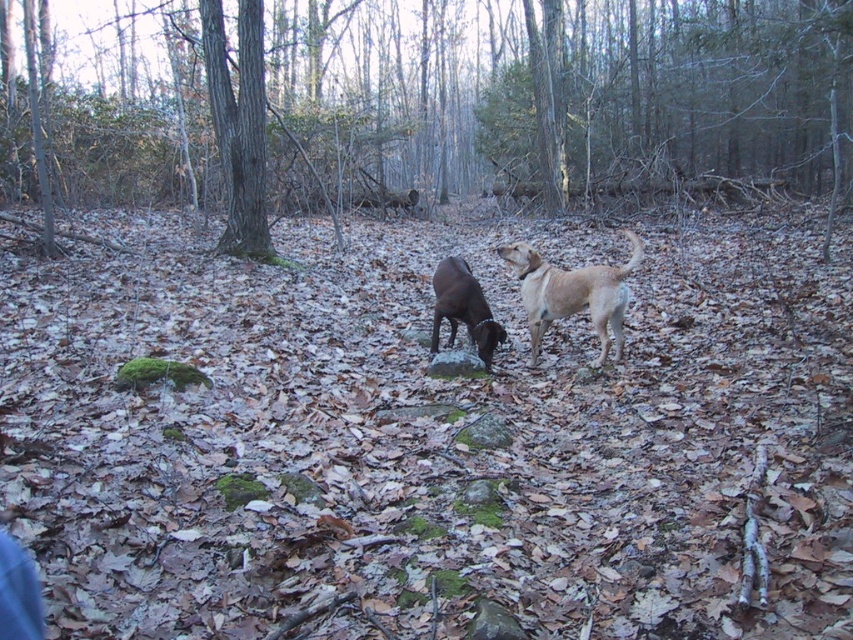
You are a hiker who wants to mark a point at coordinate point (239, 125) in the forest. Based on the scene, where would this point be located?

The point (239, 125) is on the brown rough bark tree at center, so you would mark it on the trunk of the central tree with rough bark.

You are a hiker who needs to place a 3.5 meter long rope between the brown rough bark tree at center and the light brown fur at center. Can you do it without the rope touching the ground?

The distance between the brown rough bark tree at center and the light brown fur at center is 4.09 meters. Since the rope is only 3.5 meters long, it is not long enough to span the distance between them without touching the ground.